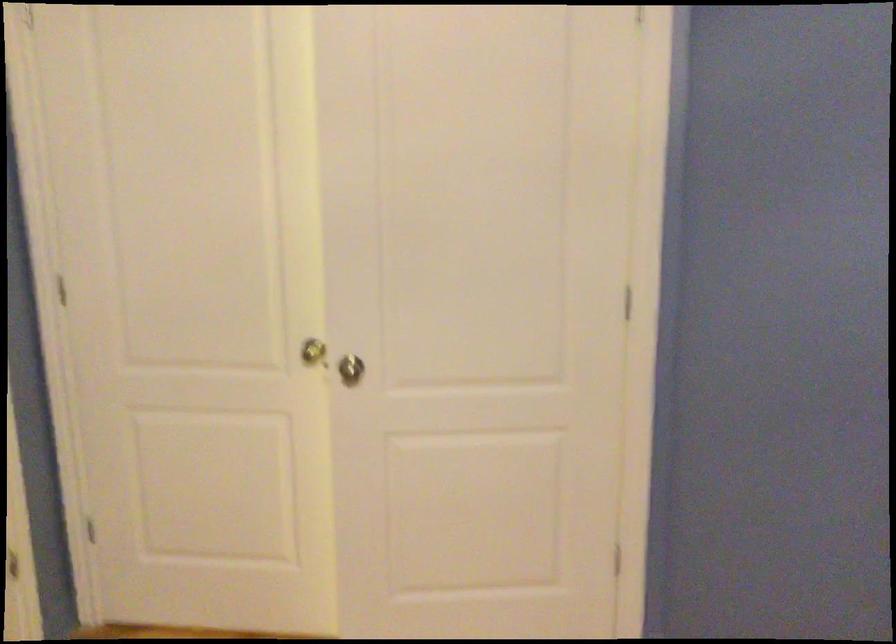
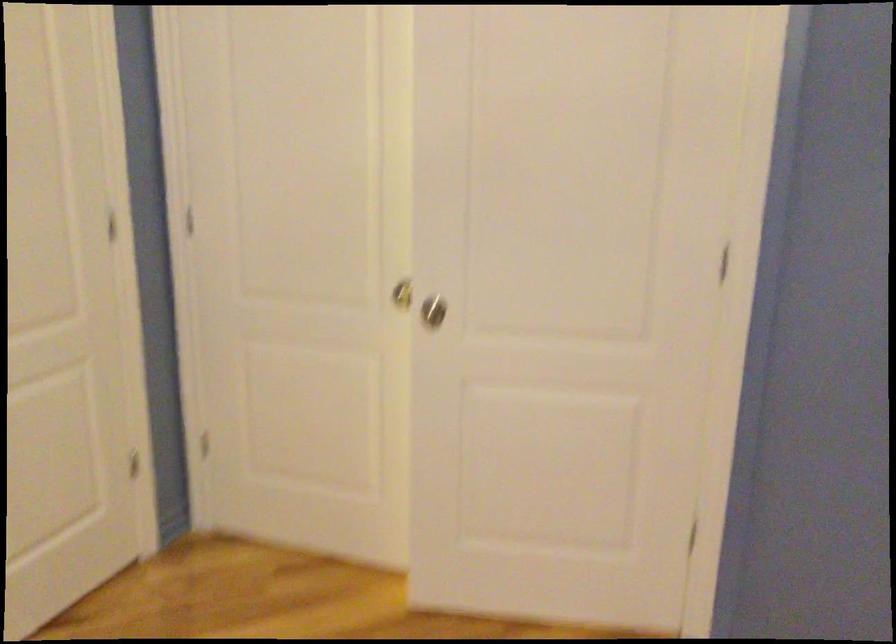
Question: What movement of the cameraman would produce the second image?

Choices:
 (A) Left
 (B) Right
 (C) Forward
 (D) Backward

Answer: (B)